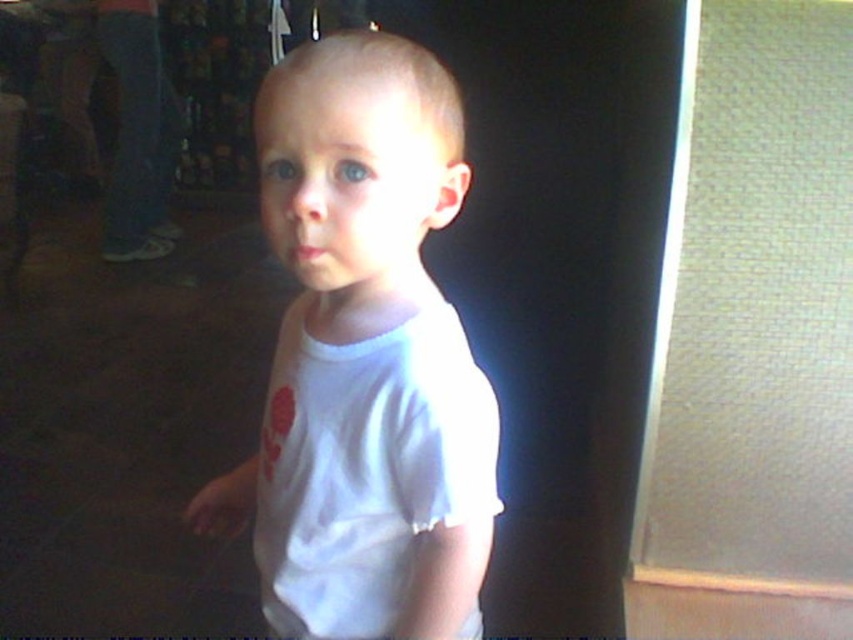
Which is above, white cotton t-shirt at center or white matte shirt at center?

white matte shirt at center is above.

Which is below, white cotton t-shirt at center or white matte shirt at center?

white cotton t-shirt at center

Does point (361, 557) come farther from viewer compared to point (109, 259)?

No, (361, 557) is closer to viewer.

Identify the location of white cotton t-shirt at center. (366, 468).

Who is more forward, (323, 52) or (126, 148)?

Positioned in front is point (323, 52).

Is white cotton shirt at center to the right of white matte shirt at center from the viewer's perspective?

Indeed, white cotton shirt at center is positioned on the right side of white matte shirt at center.

Is point (308, 212) positioned in front of point (164, 90)?

Yes, it is.

You are a GUI agent. You are given a task and a screenshot of the screen. Output one action in this format:
    pyautogui.click(x=<x>, y=<y>)
    Task: Click on the white cotton shirt at center
    
    Given the screenshot: What is the action you would take?
    pyautogui.click(x=364, y=356)

Is white cotton shirt at center above white cotton t-shirt at center?

Indeed, white cotton shirt at center is positioned over white cotton t-shirt at center.

Between point (416, 314) and point (433, 449), which one is positioned behind?

The point (416, 314) is behind.

The image size is (853, 640). What do you see at coordinates (364, 356) in the screenshot?
I see `white cotton shirt at center` at bounding box center [364, 356].

Where is `white cotton shirt at center`? The image size is (853, 640). white cotton shirt at center is located at coordinates (364, 356).